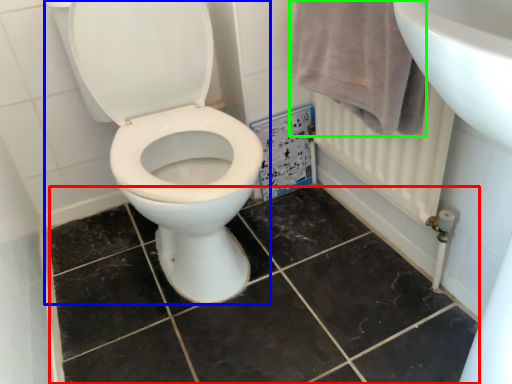
Question: Estimate the real-world distances between objects in this image. Which object is closer to ceramic tile (highlighted by a red box), toilet (highlighted by a blue box) or bath towel (highlighted by a green box)?

Choices:
 (A) toilet
 (B) bath towel

Answer: (A)